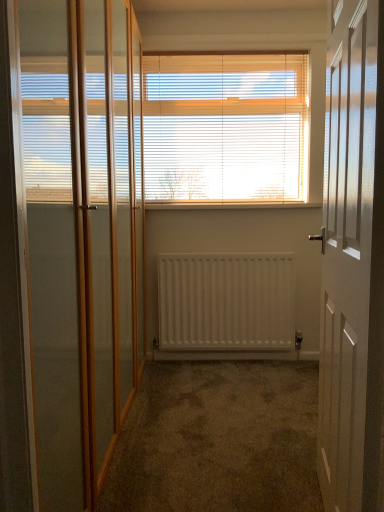
Locate an element on the screen. free space to the left of white matte radiator at center is located at coordinates (176, 371).